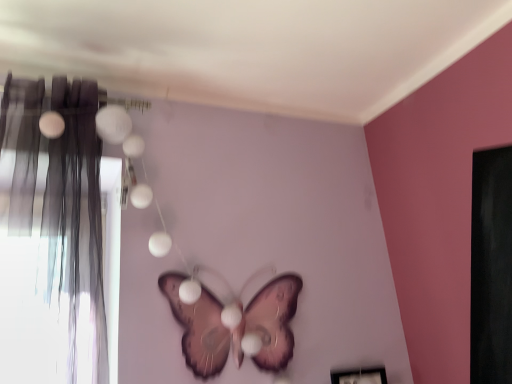
Question: Can you confirm if matte gray curtain at left is thinner than pink matte butterfly at center?

Choices:
 (A) yes
 (B) no

Answer: (B)

Question: Is matte gray curtain at left shorter than pink matte butterfly at center?

Choices:
 (A) no
 (B) yes

Answer: (A)

Question: From a real-world perspective, does matte gray curtain at left stand above pink matte butterfly at center?

Choices:
 (A) yes
 (B) no

Answer: (A)

Question: Is matte gray curtain at left positioned in front of pink matte butterfly at center?

Choices:
 (A) no
 (B) yes

Answer: (B)

Question: From a real-world perspective, is matte gray curtain at left positioned under pink matte butterfly at center based on gravity?

Choices:
 (A) no
 (B) yes

Answer: (A)

Question: Can you confirm if matte gray curtain at left is positioned to the left of pink matte butterfly at center?

Choices:
 (A) yes
 (B) no

Answer: (A)

Question: Is pink matte butterfly at center shorter than matte gray curtain at left?

Choices:
 (A) no
 (B) yes

Answer: (B)

Question: From the image's perspective, does pink matte butterfly at center appear lower than matte gray curtain at left?

Choices:
 (A) no
 (B) yes

Answer: (B)

Question: Is pink matte butterfly at center closer to the viewer compared to matte gray curtain at left?

Choices:
 (A) yes
 (B) no

Answer: (B)

Question: Is pink matte butterfly at center taller than matte gray curtain at left?

Choices:
 (A) yes
 (B) no

Answer: (B)

Question: Is pink matte butterfly at center to the right of matte gray curtain at left from the viewer's perspective?

Choices:
 (A) no
 (B) yes

Answer: (B)

Question: Is pink matte butterfly at center far from matte gray curtain at left?

Choices:
 (A) yes
 (B) no

Answer: (B)

Question: Is matte gray curtain at left to the left or to the right of pink matte butterfly at center in the image?

Choices:
 (A) left
 (B) right

Answer: (A)